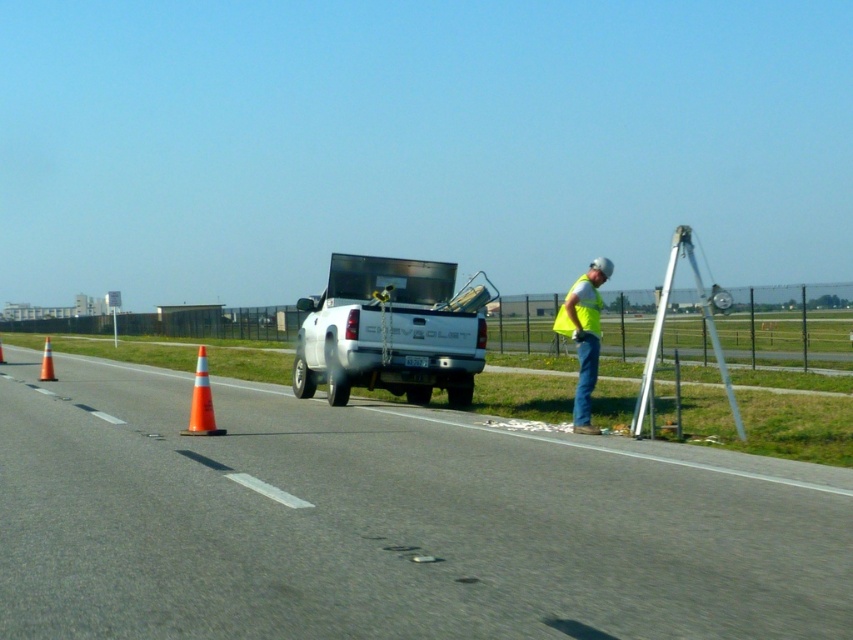
Is orange reflective cone at road center wider than orange reflective cone at center-left?

Incorrect, orange reflective cone at road center's width does not surpass orange reflective cone at center-left's.

The width and height of the screenshot is (853, 640). Find the location of `orange reflective cone at road center`. orange reflective cone at road center is located at coordinates (201, 401).

The width and height of the screenshot is (853, 640). Find the location of `orange reflective cone at road center`. orange reflective cone at road center is located at coordinates (201, 401).

Does orange reflective cone at left appear on the right side of orange reflective cone at center-left?

Yes, orange reflective cone at left is to the right of orange reflective cone at center-left.

Which of these two, orange reflective cone at left or orange reflective cone at center-left, stands shorter?

With less height is orange reflective cone at center-left.

Does point (45, 346) come in front of point (3, 360)?

That is True.

At what (x,y) coordinates should I click in order to perform the action: click on orange reflective cone at left. Please return your answer as a coordinate pair (x, y). The height and width of the screenshot is (640, 853). Looking at the image, I should click on (x=45, y=362).

Which is more to the right, white matte truck bed at center or orange reflective cone at center-left?

white matte truck bed at center

Where is `white matte truck bed at center`? This screenshot has height=640, width=853. white matte truck bed at center is located at coordinates (390, 332).